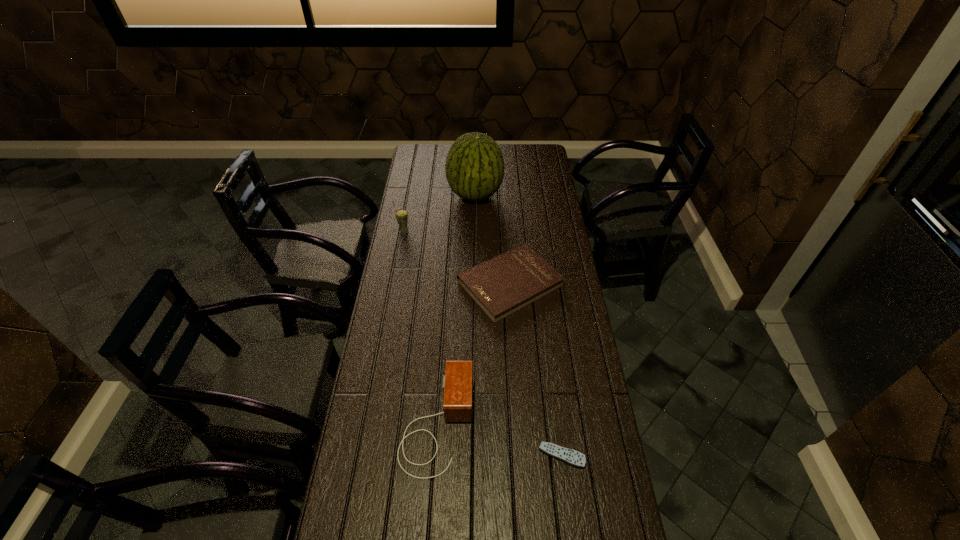
You are a GUI agent. You are given a task and a screenshot of the screen. Output one action in this format:
    pyautogui.click(x=<x>, y=<y>)
    Task: Click on the vacant space located on the front-facing side of the radio receiver
    
    Given the screenshot: What is the action you would take?
    498,423

The image size is (960, 540). What are the coordinates of `vacant area situated on the front of the third nearest object` in the screenshot? It's located at (515, 350).

Where is `vacant space situated 0.250m on the left of the remote control`? vacant space situated 0.250m on the left of the remote control is located at coordinates (455, 455).

Locate an element on the screen. The image size is (960, 540). straw for drinking located in the left edge section of the desktop is located at coordinates (401, 215).

Locate an element on the screen. radio receiver located in the left edge section of the desktop is located at coordinates 458,380.

Find the location of a particular element. The image size is (960, 540). hardback book that is at the right edge is located at coordinates (506, 283).

You are a GUI agent. You are given a task and a screenshot of the screen. Output one action in this format:
    pyautogui.click(x=<x>, y=<y>)
    Task: Click on the remote control located at the right edge
    This screenshot has width=960, height=540.
    Given the screenshot: What is the action you would take?
    pyautogui.click(x=572, y=457)

Identify the location of free space at the far edge of the desktop. (502, 149).

Locate an element on the screen. free region at the left edge is located at coordinates (405, 350).

Image resolution: width=960 pixels, height=540 pixels. Find the location of `vacant space at the right edge of the desktop`. vacant space at the right edge of the desktop is located at coordinates (536, 193).